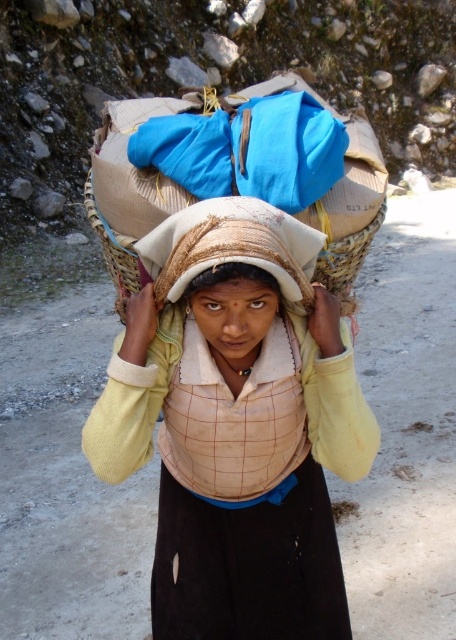
Between light beige woven cloth at center and light beige fabric at center, which one has more height?

light beige woven cloth at center

Where is `light beige woven cloth at center`? light beige woven cloth at center is located at coordinates (237, 424).

Who is lower down, light beige fabric at center or woven straw basket at center?

light beige fabric at center is lower down.

Does light beige fabric at center have a greater height compared to woven straw basket at center?

No.

At what (x,y) coordinates should I click in order to perform the action: click on light beige fabric at center. Please return your answer as a coordinate pair (x, y). The image size is (456, 640). Looking at the image, I should click on (233, 310).

Is light beige woven cloth at center bigger than woven straw basket at center?

Correct, light beige woven cloth at center is larger in size than woven straw basket at center.

Does point (144, 243) come farther from viewer compared to point (120, 307)?

No.

Which is in front, point (250, 364) or point (342, 292)?

Point (250, 364) is in front.

Where is `light beige woven cloth at center`? The image size is (456, 640). light beige woven cloth at center is located at coordinates (237, 424).